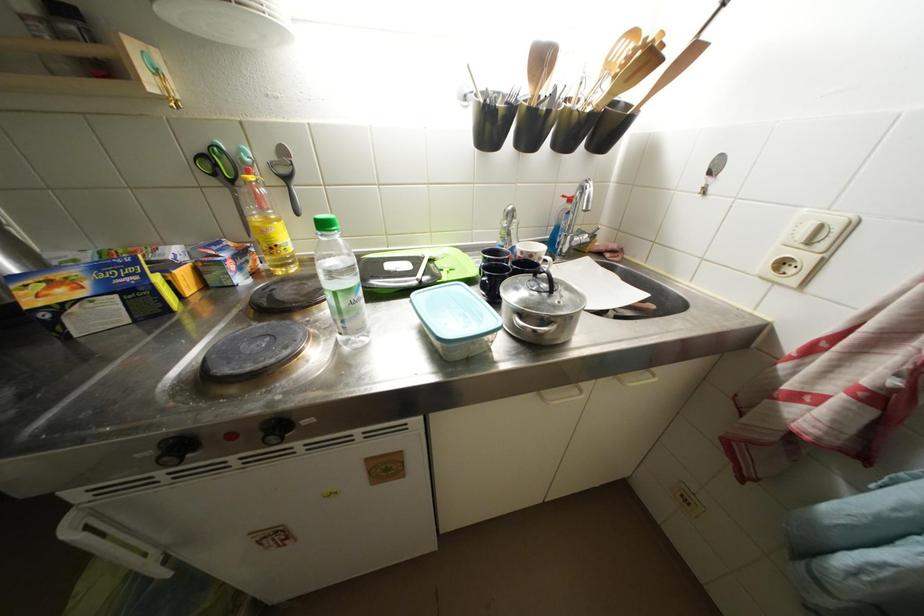
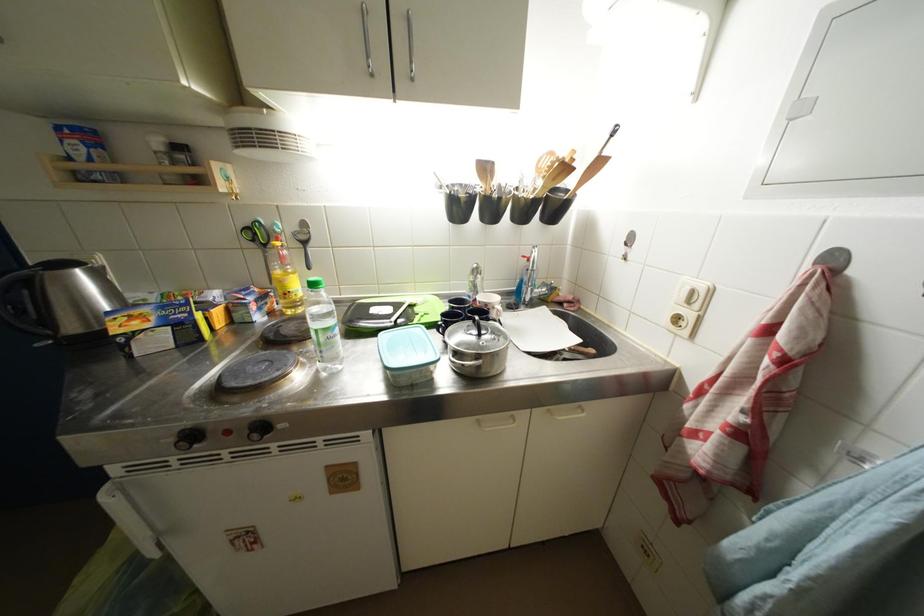
Where in the second image is the point corresponding to point (349, 309) from the first image?

(329, 344)